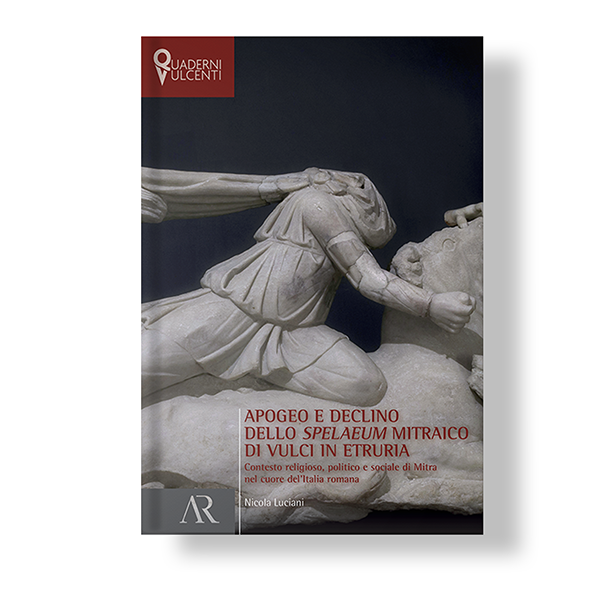
Find the location of a particular element. Image resolution: width=600 pixels, height=600 pixels. robe is located at coordinates (x=261, y=278).